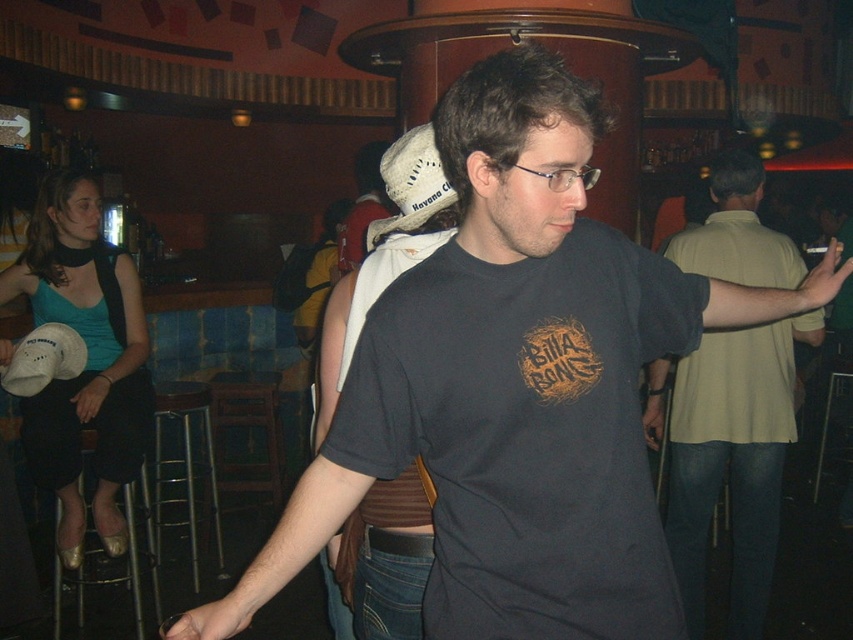
You are at a bar and want to point out two specific points on the table to your friend. The first point is labeled as point (489,525) and the second is point (427,528). Which point is closer to you when you look at the table?

Point (489,525) is closer to the viewer than point (427,528).